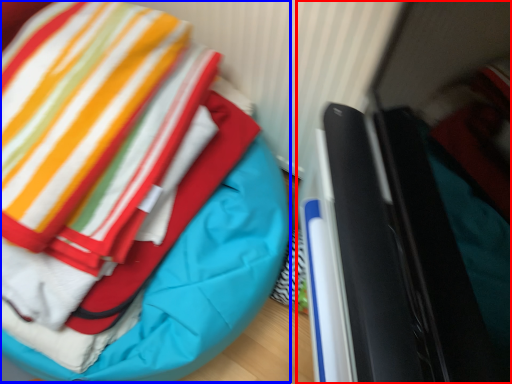
Question: Among these objects, which one is farthest to the camera, laptop (highlighted by a red box) or bean bag chair (highlighted by a blue box)?

Choices:
 (A) laptop
 (B) bean bag chair

Answer: (B)